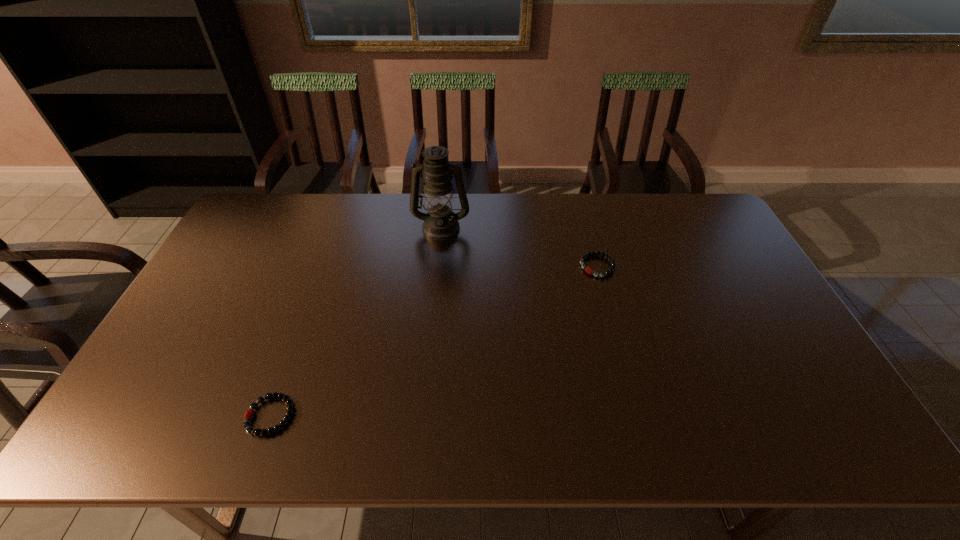
Image resolution: width=960 pixels, height=540 pixels. Find the location of `free spot between the nearer bracelet and the farther bracelet`. free spot between the nearer bracelet and the farther bracelet is located at coordinates (434, 341).

The width and height of the screenshot is (960, 540). I want to click on vacant area that lies between the right bracelet and the left bracelet, so click(x=434, y=341).

Where is `free space that is in between the nearest object and the rightmost object`? This screenshot has height=540, width=960. free space that is in between the nearest object and the rightmost object is located at coordinates (434, 341).

Where is `vacant space in between the nearer bracelet and the second object from left to right`? This screenshot has height=540, width=960. vacant space in between the nearer bracelet and the second object from left to right is located at coordinates (356, 321).

Where is `free spot between the left bracelet and the rightmost object`? The image size is (960, 540). free spot between the left bracelet and the rightmost object is located at coordinates (434, 341).

Find the location of a particular element. unoccupied position between the tallest object and the nearer bracelet is located at coordinates (356, 321).

The width and height of the screenshot is (960, 540). I want to click on vacant space that is in between the rightmost object and the leftmost object, so click(434, 341).

At what (x,y) coordinates should I click in order to perform the action: click on vacant region between the leftmost object and the second farthest object. Please return your answer as a coordinate pair (x, y). Looking at the image, I should click on 434,341.

Identify which object is located as the second nearest to the tallest object. Please provide its 2D coordinates. Your answer should be formatted as a tuple, i.e. [(x, y)], where the tuple contains the x and y coordinates of a point satisfying the conditions above.

[(249, 415)]

The height and width of the screenshot is (540, 960). I want to click on object that stands as the closest to the tallest object, so (589, 270).